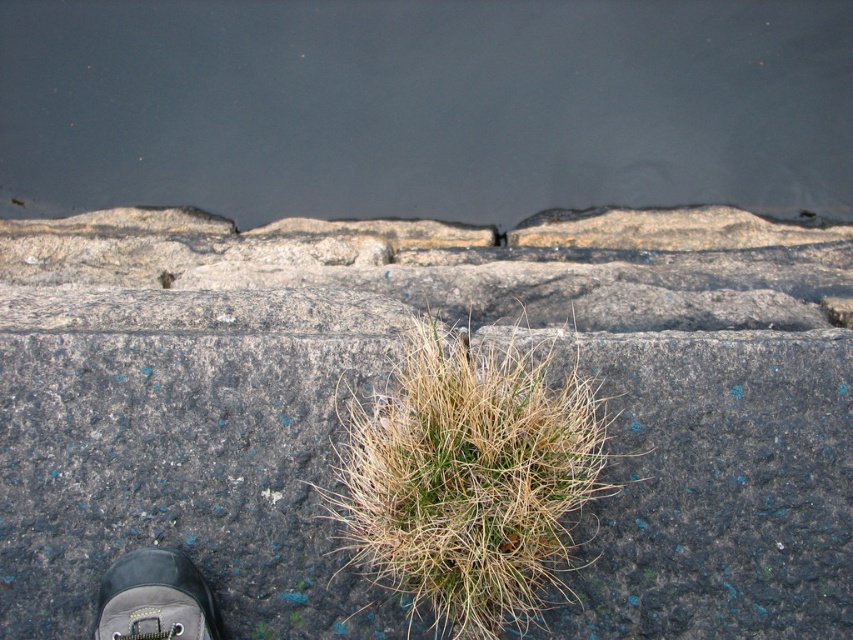
Between point (750, 588) and point (172, 621), which one is positioned behind?

The point (750, 588) is more distant.

Is point (598, 516) farther from viewer compared to point (194, 572)?

Yes, it is.

Find the location of a particular element. This screenshot has height=640, width=853. gray concrete pavement at center is located at coordinates (178, 474).

Between dry grass at center and leather shoe at lower left, which one has more height?

dry grass at center is taller.

Who is positioned more to the right, dry grass at center or leather shoe at lower left?

From the viewer's perspective, dry grass at center appears more on the right side.

Where is `dry grass at center`? dry grass at center is located at coordinates (469, 481).

Which is behind, point (819, 424) or point (448, 529)?

The point (819, 424) is behind.

What are the coordinates of `gray concrete pavement at center` in the screenshot? It's located at (178, 474).

Is point (824, 371) closer to camera compared to point (329, 500)?

No, it is not.

Where is `gray concrete pavement at center`? The width and height of the screenshot is (853, 640). gray concrete pavement at center is located at coordinates (178, 474).